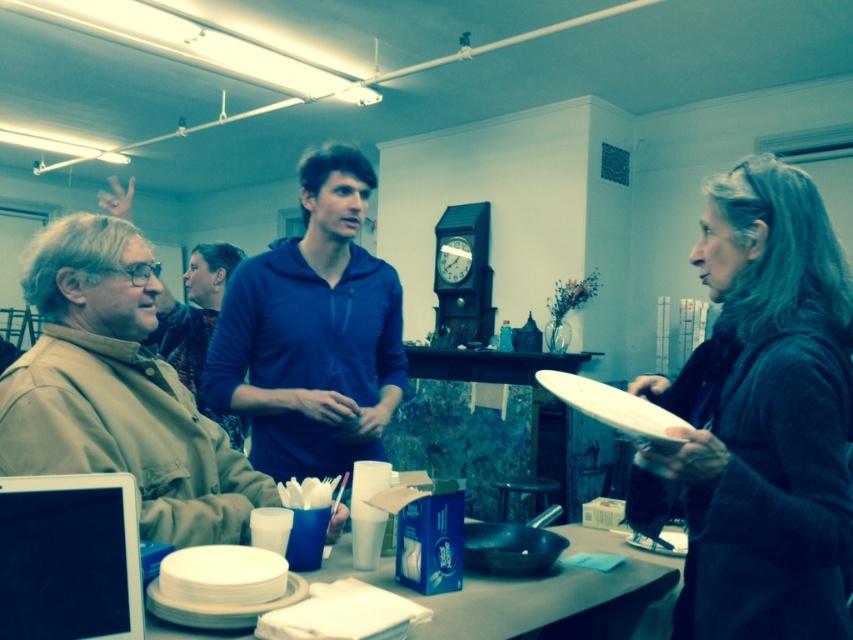
Is khaki fabric jacket at left wider than blue matte hoodie at center?

Yes.

Is point (149, 442) positioned before point (335, 440)?

Yes, point (149, 442) is in front of point (335, 440).

Does point (91, 339) come closer to viewer compared to point (212, 404)?

Yes, point (91, 339) is in front of point (212, 404).

Image resolution: width=853 pixels, height=640 pixels. Find the location of `khaki fabric jacket at left`. khaki fabric jacket at left is located at coordinates (117, 390).

The width and height of the screenshot is (853, 640). What do you see at coordinates (199, 323) in the screenshot? I see `blue zip-up hoodie at center` at bounding box center [199, 323].

Is point (225, 426) farther from viewer compared to point (575, 387)?

That is True.

The width and height of the screenshot is (853, 640). What are the coordinates of `blue zip-up hoodie at center` in the screenshot? It's located at (199, 323).

Can you confirm if khaki fabric jacket at left is positioned below white matte plate at lower left?

Incorrect, khaki fabric jacket at left is not positioned below white matte plate at lower left.

Which of these two, khaki fabric jacket at left or white matte plate at lower left, stands shorter?

With less height is white matte plate at lower left.

Where is `khaki fabric jacket at left`? The width and height of the screenshot is (853, 640). khaki fabric jacket at left is located at coordinates (117, 390).